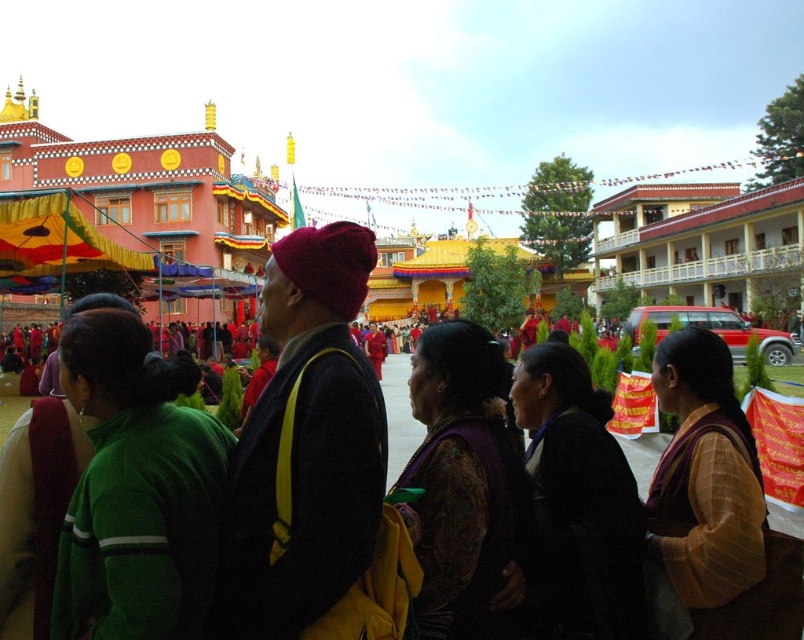
Question: Does black velvet dress at center appear under silky yellow dress at center?

Choices:
 (A) no
 (B) yes

Answer: (B)

Question: Which point appears closest to the camera in this image?

Choices:
 (A) click(177, 355)
 (B) click(753, 513)
 (C) click(589, 508)
 (D) click(679, 296)

Answer: (B)

Question: Is dark purple velvet dress at center below white glossy building at upper right?

Choices:
 (A) yes
 (B) no

Answer: (A)

Question: Which of the following is the farthest from the observer?

Choices:
 (A) black velvet dress at center
 (B) white glossy building at upper right
 (C) dark red woolen hat at center

Answer: (B)

Question: Observing the image, what is the correct spatial positioning of green fabric at center in reference to white glossy building at upper right?

Choices:
 (A) above
 (B) below

Answer: (B)

Question: Which object is the closest to the white glossy building at upper right?

Choices:
 (A) silky yellow dress at center
 (B) dark purple velvet dress at center
 (C) dark red woolen hat at center
 (D) black velvet dress at center

Answer: (A)